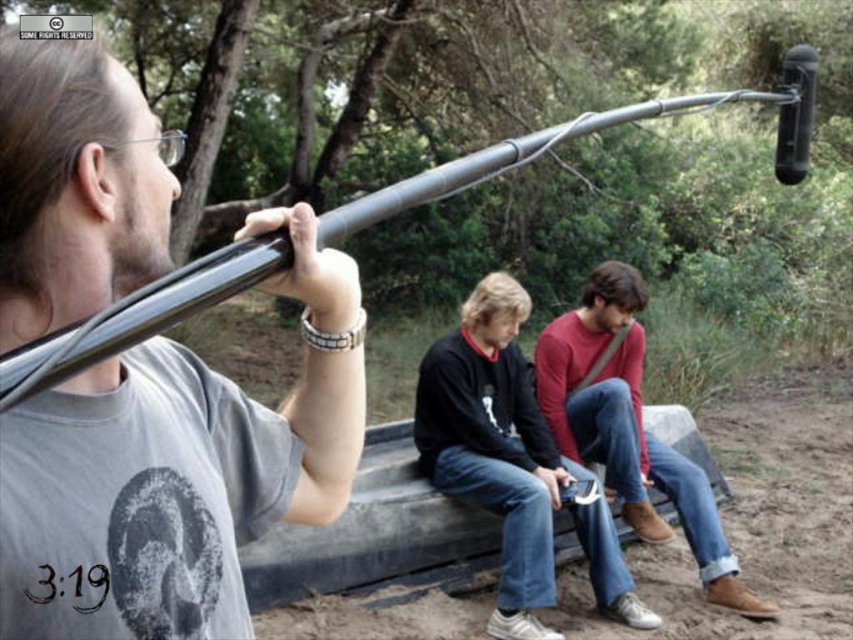
Question: Considering the real-world distances, which object is closest to the dark blue jeans at center?

Choices:
 (A) metallic gray pole at upper left
 (B) matte red sweater at center

Answer: (B)

Question: Considering the relative positions of metallic gray pole at upper left and matte red sweater at center in the image provided, where is metallic gray pole at upper left located with respect to matte red sweater at center?

Choices:
 (A) right
 (B) left

Answer: (B)

Question: Which of the following is the farthest from the observer?

Choices:
 (A) (601, 352)
 (B) (108, 122)
 (C) (535, 454)

Answer: (A)

Question: Is metallic gray pole at upper left below matte red sweater at center?

Choices:
 (A) no
 (B) yes

Answer: (A)

Question: Among these points, which one is farthest from the camera?

Choices:
 (A) (474, 490)
 (B) (206, 392)
 (C) (628, 336)

Answer: (C)

Question: Is dark blue jeans at center below matte red sweater at center?

Choices:
 (A) yes
 (B) no

Answer: (A)